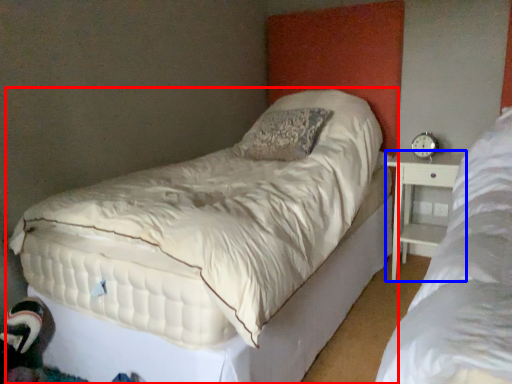
Question: Which of the following is the closest to the observer, bed (highlighted by a red box) or nightstand (highlighted by a blue box)?

Choices:
 (A) bed
 (B) nightstand

Answer: (A)